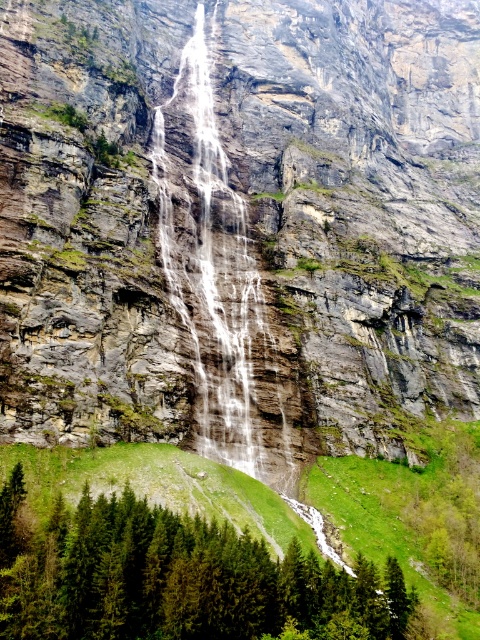
Consider the image. You are a hiker planning to cross the clear water at center to reach the other side. The rocky cliff face at center is in your path. Considering their widths, which one would you need to navigate around first?

The rocky cliff face at center is wider than the clear water at center, so you would need to navigate around the rocky cliff face at center first.

You are standing at the edge of the cliff overlooking the waterfall. You see the green matte tree at lower left and the clear water at center. From your vantage point, which object is positioned to the right side?

The green matte tree at lower left is positioned to the right of the clear water at center.